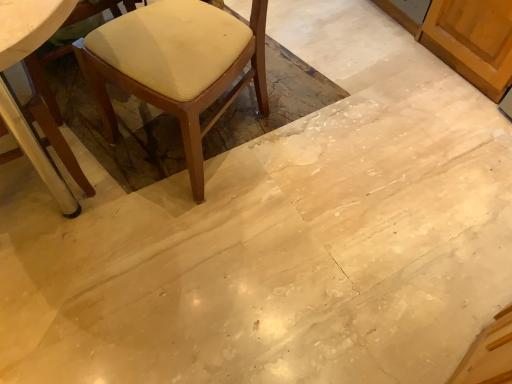
Where is `free spot in front of wooden chair at left, which is the 2th chair in right-to-left order`? The width and height of the screenshot is (512, 384). free spot in front of wooden chair at left, which is the 2th chair in right-to-left order is located at coordinates (54, 298).